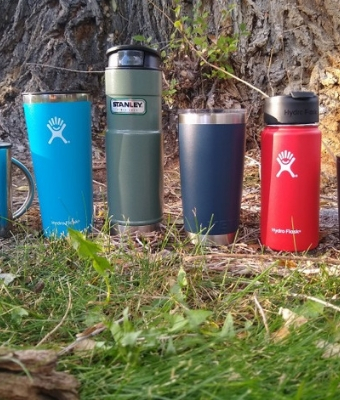
Where is `drink container`? The width and height of the screenshot is (340, 400). drink container is located at coordinates (3, 175), (75, 149), (131, 141), (197, 153), (286, 176).